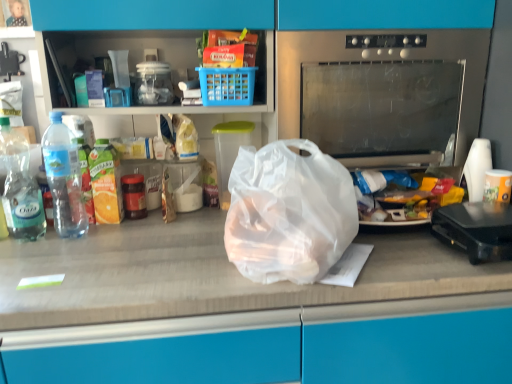
Locate an element on the screen. vacant area that lies to the right of clear plastic bottle at left, which is the first bottle from left to right is located at coordinates (87, 241).